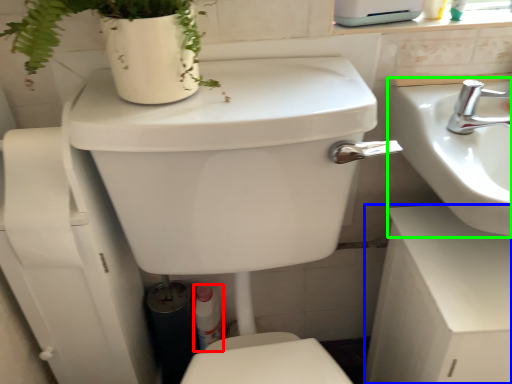
Question: Estimate the real-world distances between objects in this image. Which object is farther from toiletry (highlighted by a red box), counter top (highlighted by a blue box) or sink (highlighted by a green box)?

Choices:
 (A) counter top
 (B) sink

Answer: (B)